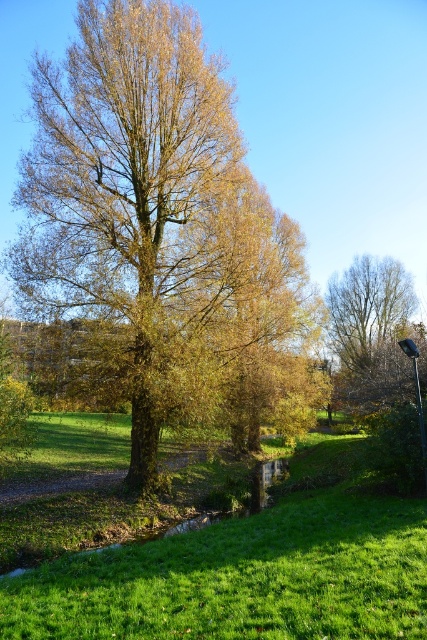
Can you confirm if golden-brown bark tree at center is positioned below green grass at center?

Actually, golden-brown bark tree at center is above green grass at center.

Between golden-brown bark tree at center and green grass at center, which one appears on the right side from the viewer's perspective?

Positioned to the right is green grass at center.

Who is more forward, (198, 116) or (152, 572)?

Point (152, 572)

Locate an element on the screen. The image size is (427, 640). golden-brown bark tree at center is located at coordinates (149, 212).

Can you confirm if golden-brown bark tree at center is positioned above metallic gray lamp post at lower right?

Yes.

Which is above, golden-brown bark tree at center or metallic gray lamp post at lower right?

golden-brown bark tree at center is higher up.

Who is more distant from viewer, (265, 317) or (415, 364)?

The point (265, 317) is more distant.

Identify the location of golden-brown bark tree at center. (149, 212).

How much distance is there between green grass at center and metallic gray lamp post at lower right?

green grass at center is 3.89 meters from metallic gray lamp post at lower right.

Is point (295, 518) more distant than point (421, 419)?

No.

Identify the location of green grass at center. (243, 579).